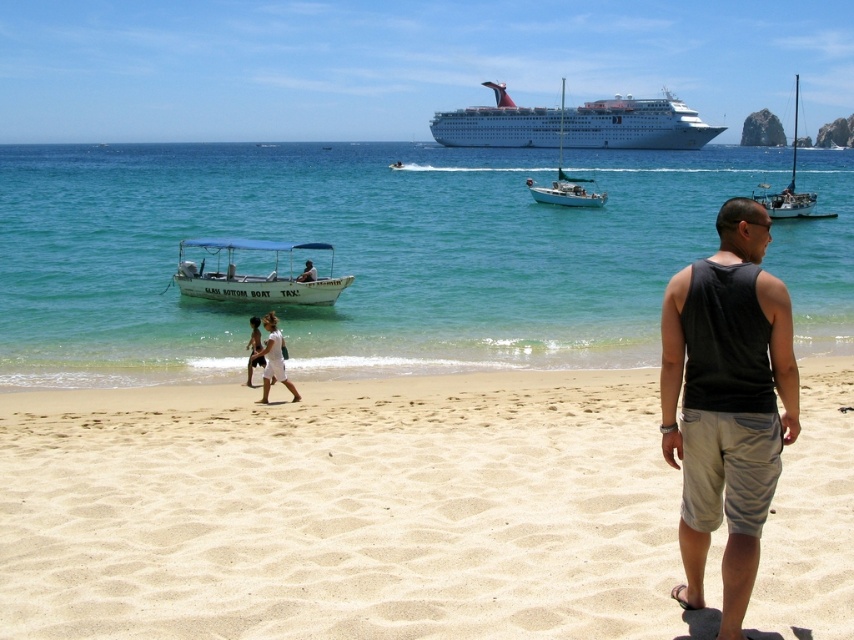
You are a photographer trying to capture a photo of the white cotton dress at center and the white glossy cruise ship at upper center. Since both are white, you want to ensure you can distinguish them in your photo. What feature can you use to tell them apart?

The white glossy cruise ship at upper center is bigger than the white cotton dress at center, so you can distinguish them by their size.

You are standing on the beach and want to move from point A to point B. Point A is at coordinate point (544, 145) and point B is at coordinate point (264, 365). Which direction should you walk to get from point A to point B?

You should walk away from the camera towards the ocean because point (264, 365) is further away from the camera than point (544, 145).

You are a photographer trying to capture the entire scene of the white matte motor boat at center and the white cotton dress at center in a single shot. Based on their sizes, which object should you focus on to ensure both are visible without cropping?

The white matte motor boat at center is larger than the white cotton dress at center, so focusing on the boat will allow both to be visible without cropping.